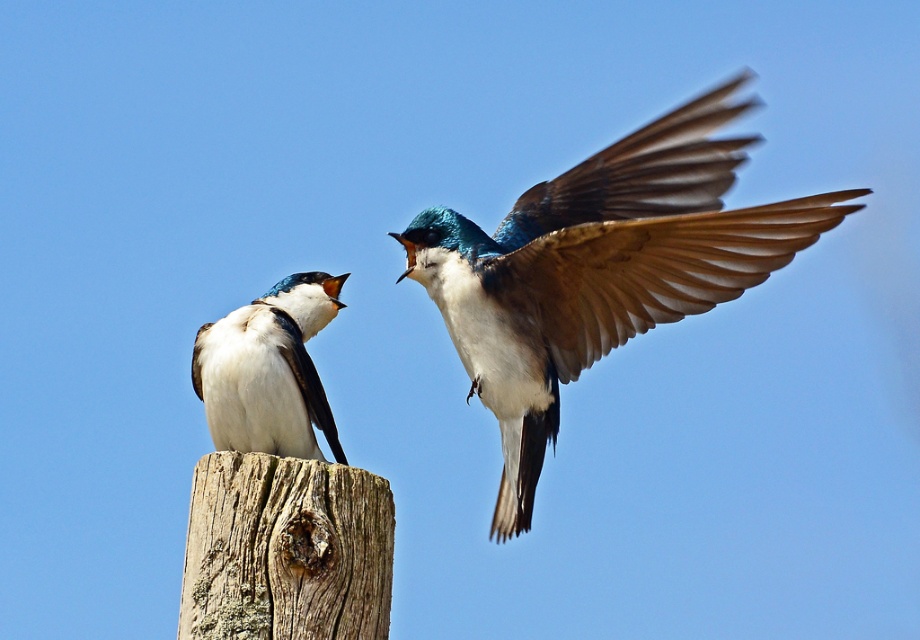
Question: Which object appears farthest from the camera in this image?

Choices:
 (A) shiny blue and white bird at center
 (B) white matte bird at left

Answer: (B)

Question: Can you confirm if shiny blue and white bird at center is bigger than white matte bird at left?

Choices:
 (A) no
 (B) yes

Answer: (B)

Question: Does shiny blue and white bird at center have a greater width compared to white matte bird at left?

Choices:
 (A) no
 (B) yes

Answer: (B)

Question: Which object appears closest to the camera in this image?

Choices:
 (A) shiny blue and white bird at center
 (B) white matte bird at left

Answer: (A)

Question: Can you confirm if shiny blue and white bird at center is positioned below white matte bird at left?

Choices:
 (A) yes
 (B) no

Answer: (B)